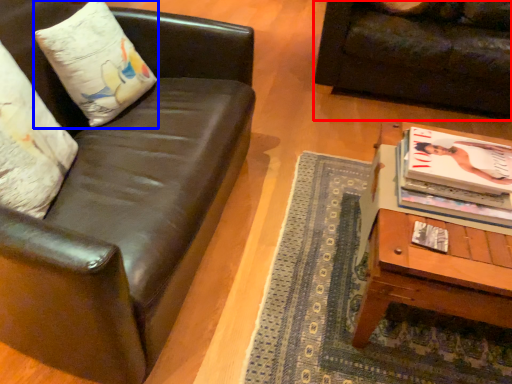
Question: Which point is further to the camera, studio couch (highlighted by a red box) or pillow (highlighted by a blue box)?

Choices:
 (A) studio couch
 (B) pillow

Answer: (A)